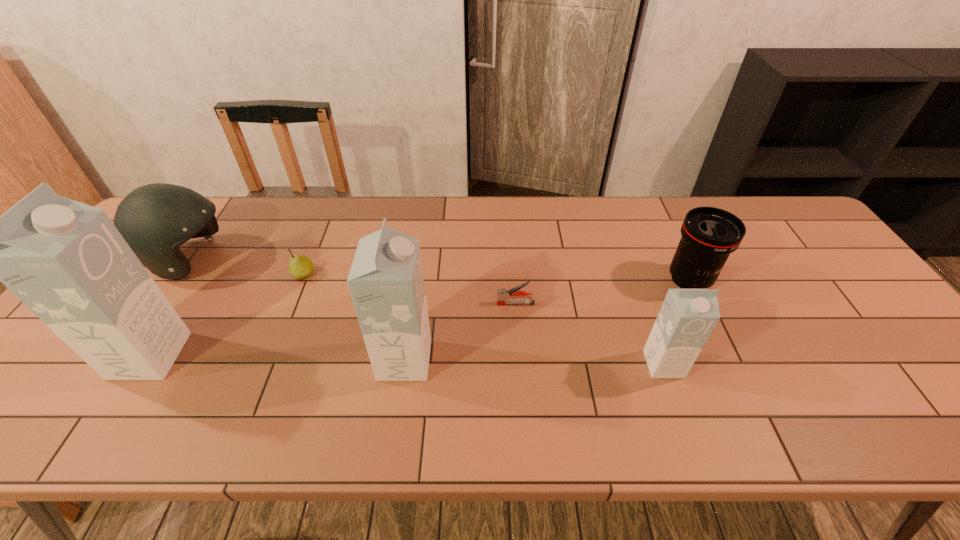
Locate an element on the screen. This screenshot has height=540, width=960. the second shortest object is located at coordinates (300, 267).

Identify the location of the third object from left to right. (300, 267).

The image size is (960, 540). What are the coordinates of `free spot located on the front label of the leftmost carton` in the screenshot? It's located at (324, 356).

In order to click on blank area located 0.080m on the front label of the second tallest object in this screenshot , I will do `click(464, 360)`.

The height and width of the screenshot is (540, 960). Identify the location of free space located 0.130m on the right of the fifth tallest object. (762, 280).

You are a GUI agent. You are given a task and a screenshot of the screen. Output one action in this format:
    pyautogui.click(x=<x>, y=<y>)
    Task: Click on the free spot located 0.170m at the face opening of the football helmet
    This screenshot has height=540, width=960.
    Given the screenshot: What is the action you would take?
    pyautogui.click(x=292, y=260)

This screenshot has width=960, height=540. Find the location of `vacant space located on the handle side of the fourth nearest object`. vacant space located on the handle side of the fourth nearest object is located at coordinates (444, 303).

Identify the location of vacant area located 0.210m on the handle side of the fourth nearest object. Image resolution: width=960 pixels, height=540 pixels. (417, 303).

The height and width of the screenshot is (540, 960). What are the coordinates of `free location located 0.370m on the handle side of the fourth nearest object` in the screenshot? It's located at (356, 303).

Find the location of a particular element. free space located on the back of the pear is located at coordinates (324, 225).